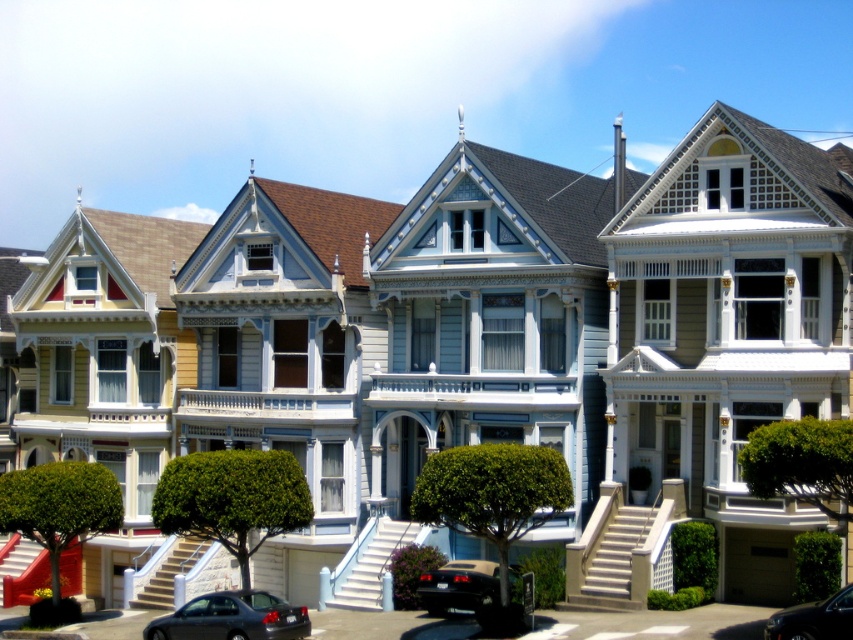
You are standing at the sidewalk in front of the row of Victorian houses. You notice two shiny black vehicles. Which one is positioned lower in the image, the shiny black sedan at lower left or the shiny black car at center?

The shiny black sedan at lower left is positioned below the shiny black car at center, so it is lower in the image.

You are standing at the bottom left corner of the image. You want to walk directly towards the shiny black car at lower center. Which direction should you head?

Since the shiny black car at lower center is located at point 0.917 on the x axis and 0.538 on the y axis, you should head towards the right direction to reach it.